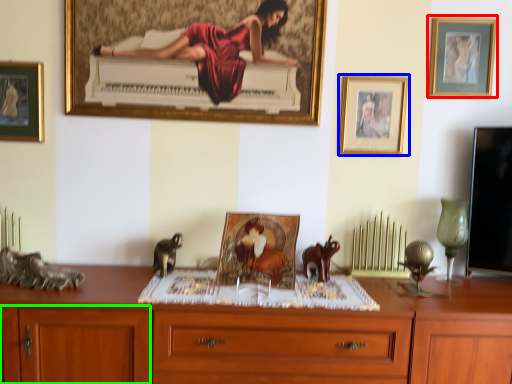
Question: Which is nearer to the picture frame (highlighted by a red box)? picture frame (highlighted by a blue box) or cabinetry (highlighted by a green box).

Choices:
 (A) picture frame
 (B) cabinetry

Answer: (A)